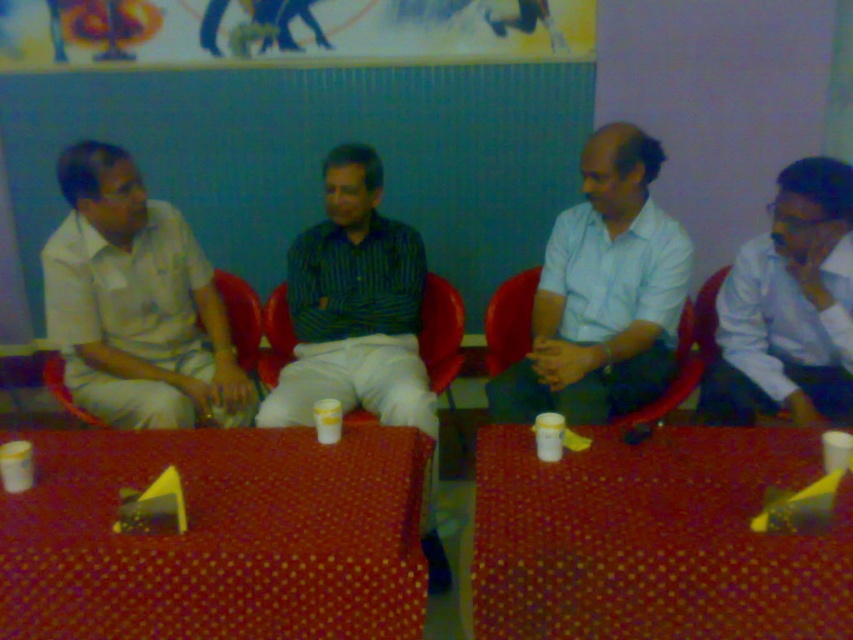
You are standing in the room where the four men are sitting. You need to place a small plant between the white matte shirt at left and the matte plastic chair at center. Based on their positions, where should the plant be placed?

The white matte shirt at left is above the matte plastic chair at center, so the plant should be placed between them horizontally at the same vertical level as the matte plastic chair at center.

You are standing in the meeting room and need to find the light blue shirt at center. Based on the coordinates provided, where should you look relative to the other objects in the scene?

The light blue shirt at center is located at point 0.459 on the x axis and 0.708 on the y axis, so you should look towards the center of the image slightly to the right and up from the bottom.

You are a photographer setting up for a group photo. You need to place a camera on the polka dot fabric table at lower center so it can capture the matte plastic chair at center clearly. Is the table positioned in a way that allows the camera to see the chair without obstruction?

The polka dot fabric table at lower center is closer to the viewer than the matte plastic chair at center, so placing the camera on the table would allow it to see the chair without obstruction since the table is in front of the chair.